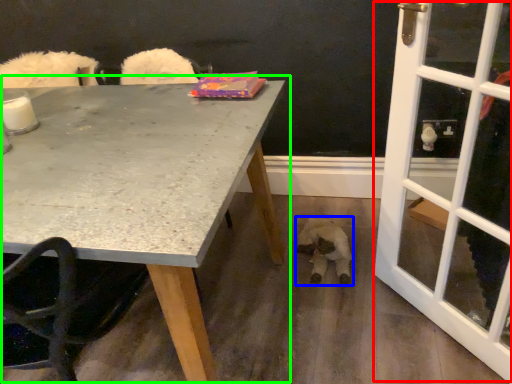
Question: Considering the real-world distances, which object is closest to screen door (highlighted by a red box)? animal (highlighted by a blue box) or table (highlighted by a green box).

Choices:
 (A) animal
 (B) table

Answer: (A)